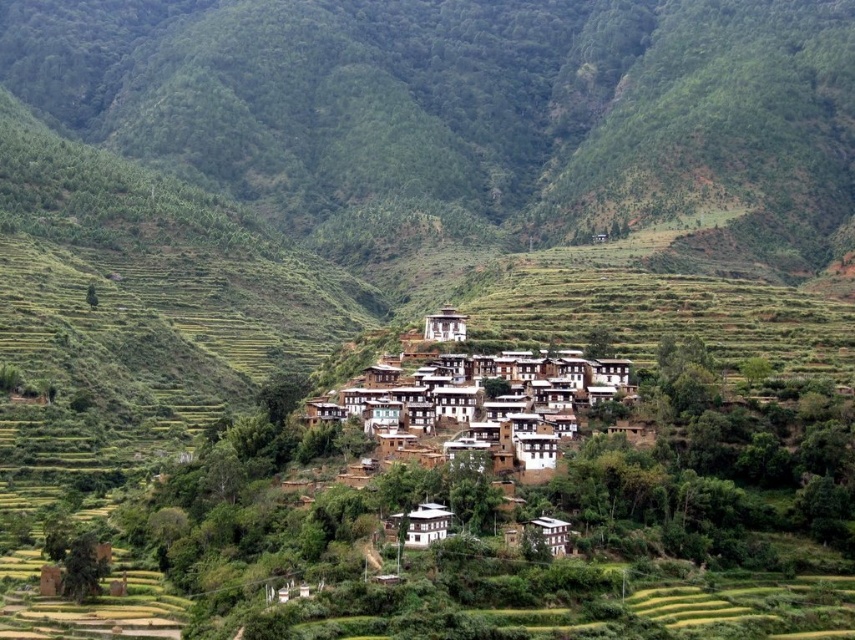
You are planning to build a small garden on the green grassy hillside at center and the white stucco village at center. Which location would allow for a larger garden area?

The green grassy hillside at center might be wider than the white stucco village at center, so it could accommodate a larger garden area.

You are standing at the entrance of the village and want to reach the green grassy hillside at center. According to the coordinates provided, in which direction should you head from your current position?

The green grassy hillside at center is located at coordinates point (472,113). Since you are at the entrance of the village, you should head towards the center of the image to reach it.

You are standing at the point marked as point [472,113] in the image. What is the name of the feature you are currently standing on?

You are standing on the green grassy hillside at center located at point [472,113].